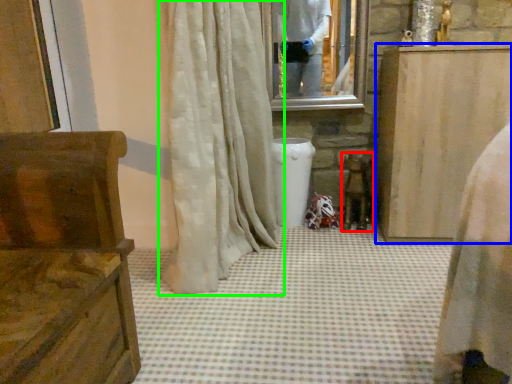
Question: Which object is positioned closest to chair (highlighted by a red box)? Select from furniture (highlighted by a blue box) and curtain (highlighted by a green box).

Choices:
 (A) furniture
 (B) curtain

Answer: (A)